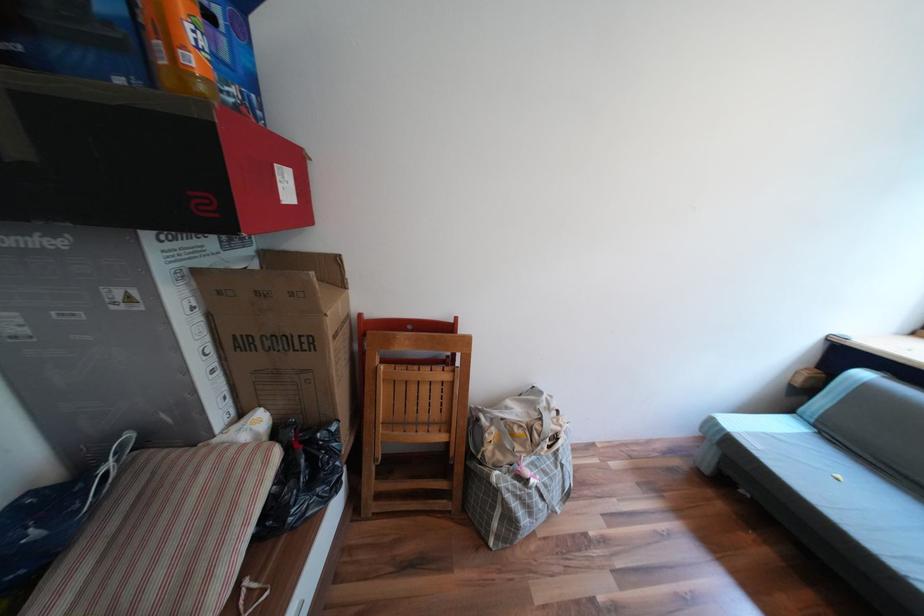
Find the location of a particular element. red and black box is located at coordinates (141, 160).